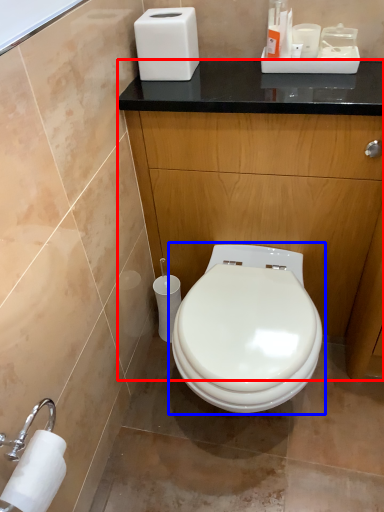
Question: Which of the following is the farthest to the observer, dresser (highlighted by a red box) or toilet (highlighted by a blue box)?

Choices:
 (A) dresser
 (B) toilet

Answer: (A)